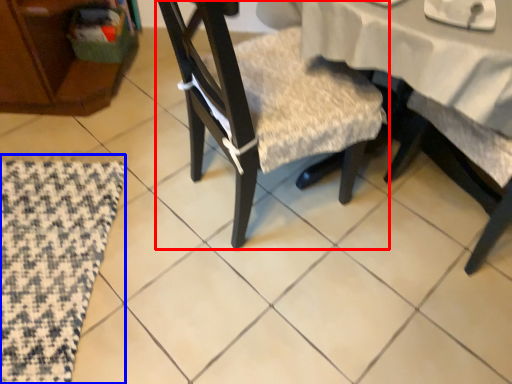
Question: Among these objects, which one is farthest to the camera, chair (highlighted by a red box) or mat (highlighted by a blue box)?

Choices:
 (A) chair
 (B) mat

Answer: (B)